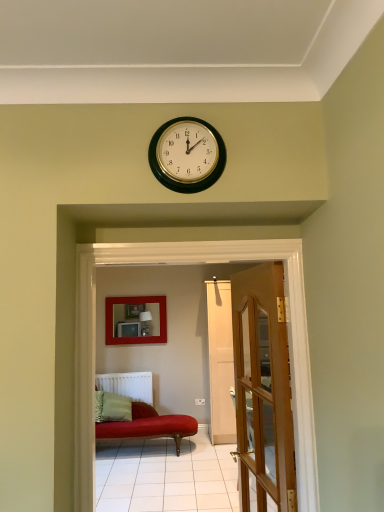
I want to click on matte red picture frame at center, so click(x=136, y=337).

This screenshot has width=384, height=512. Describe the element at coordinates (136, 337) in the screenshot. I see `matte red picture frame at center` at that location.

The width and height of the screenshot is (384, 512). Describe the element at coordinates (263, 388) in the screenshot. I see `wooden glass door at center` at that location.

Find the location of a particular element. This screenshot has height=512, width=384. matte red picture frame at center is located at coordinates (136, 337).

Considering the relative positions of matte red couch at center and green fabric pillow at lower left in the image provided, is matte red couch at center behind green fabric pillow at lower left?

No, it is not.

I want to click on pillow located underneath the matte red couch at center (from a real-world perspective), so click(112, 407).

Is matte red couch at center inside the boundaries of green fabric pillow at lower left, or outside?

The correct answer is: outside.

Is matte red picture frame at center at the right side of white matte radiator at lower left?

Yes, matte red picture frame at center is to the right of white matte radiator at lower left.

Is the surface of matte red picture frame at center in direct contact with white matte radiator at lower left?

No, matte red picture frame at center is not touching white matte radiator at lower left.

Considering the sizes of matte red picture frame at center and white matte radiator at lower left in the image, is matte red picture frame at center wider or thinner than white matte radiator at lower left?

Considering their sizes, matte red picture frame at center looks slimmer than white matte radiator at lower left.

From the image's perspective, between matte red picture frame at center and wooden glass door at center, who is located below?

matte red picture frame at center, from the image's perspective.

Considering the relative sizes of matte red picture frame at center and wooden glass door at center in the image provided, is matte red picture frame at center smaller than wooden glass door at center?

Yes, matte red picture frame at center is smaller than wooden glass door at center.

Is matte red picture frame at center outside of wooden glass door at center?

Yes.

From the image's perspective, who appears lower, green fabric pillow at lower left or matte red picture frame at center?

green fabric pillow at lower left is shown below in the image.

In the image, is green fabric pillow at lower left positioned in front of or behind matte red picture frame at center?

Visually, green fabric pillow at lower left is located in front of matte red picture frame at center.

Can you confirm if green fabric pillow at lower left is wider than matte red picture frame at center?

Yes.

Is green fabric pillow at lower left far away from matte red picture frame at center?

No, green fabric pillow at lower left is in close proximity to matte red picture frame at center.

Locate an element on the screen. Image resolution: width=384 pixels, height=512 pixels. radiator that appears below the matte red picture frame at center (from a real-world perspective) is located at coordinates (127, 385).

Is point (122, 377) closer or farther from the camera than point (162, 326)?

Point (122, 377) is closer to the camera than point (162, 326).

Considering the relative positions of white matte radiator at lower left and matte red picture frame at center in the image provided, is white matte radiator at lower left behind matte red picture frame at center?

No.

Could you tell me if white matte radiator at lower left is facing matte red picture frame at center?

No, white matte radiator at lower left is not aimed at matte red picture frame at center.

Consider the image. Considering the relative positions of matte red couch at center and wooden glass door at center in the image provided, is matte red couch at center in front of wooden glass door at center?

Yes.

Considering the sizes of matte red couch at center and wooden glass door at center in the image, is matte red couch at center bigger or smaller than wooden glass door at center?

In the image, matte red couch at center appears to be smaller than wooden glass door at center.

Is matte red couch at center positioned with its back to wooden glass door at center?

matte red couch at center does not have its back to wooden glass door at center.

Visually, is matte red couch at center positioned to the left or to the right of wooden glass door at center?

matte red couch at center is to the left of wooden glass door at center.

Can you confirm if matte red couch at center is taller than white matte radiator at lower left?

Yes, matte red couch at center is taller than white matte radiator at lower left.

Is matte red couch at center bigger or smaller than white matte radiator at lower left?

matte red couch at center is bigger than white matte radiator at lower left.

How many degrees apart are the facing directions of matte red couch at center and white matte radiator at lower left?

The facing directions of matte red couch at center and white matte radiator at lower left are 179 degrees apart.

Looking at this image, considering the relative positions of matte red couch at center and white matte radiator at lower left in the image provided, is matte red couch at center behind white matte radiator at lower left?

That is False.

At what (x,y) coordinates should I click in order to perform the action: click on pillow below the matte red couch at center (from the image's perspective). Please return your answer as a coordinate pair (x, y). The width and height of the screenshot is (384, 512). Looking at the image, I should click on (112, 407).

The image size is (384, 512). Identify the location of picture frame above the white matte radiator at lower left (from a real-world perspective). (136, 337).

Which object lies further to the anchor point green fabric pillow at lower left, white matte radiator at lower left or matte red couch at center?

matte red couch at center is positioned further to the anchor green fabric pillow at lower left.

From the image, which object appears to be nearer to wooden glass door at center, white matte radiator at lower left or matte red picture frame at center?

white matte radiator at lower left is positioned closer to the anchor wooden glass door at center.

Looking at the image, which one is located closer to matte red couch at center, green fabric pillow at lower left or matte red picture frame at center?

Based on the image, green fabric pillow at lower left appears to be nearer to matte red couch at center.

Which object lies nearer to the anchor point matte red couch at center, white matte radiator at lower left or wooden glass door at center?

wooden glass door at center is positioned closer to the anchor matte red couch at center.

Based on their spatial positions, is white matte radiator at lower left or matte red couch at center further from matte red picture frame at center?

matte red couch at center.

Estimate the real-world distances between objects in this image. Which object is further from matte red picture frame at center, white matte radiator at lower left or wooden glass door at center?

The object further to matte red picture frame at center is wooden glass door at center.

Which object lies nearer to the anchor point matte red picture frame at center, matte red couch at center or wooden glass door at center?

Among the two, wooden glass door at center is located nearer to matte red picture frame at center.

Based on the photo, from the image, which object appears to be nearer to matte red couch at center, wooden glass door at center or matte red picture frame at center?

The object closer to matte red couch at center is wooden glass door at center.

Where is `pillow positioned between matte red couch at center and matte red picture frame at center from near to far`? pillow positioned between matte red couch at center and matte red picture frame at center from near to far is located at coordinates (112, 407).

Find the location of a particular element. The width and height of the screenshot is (384, 512). door positioned between matte red couch at center and white matte radiator at lower left from near to far is located at coordinates click(x=263, y=388).

Locate an element on the screen. radiator positioned between wooden glass door at center and matte red picture frame at center from near to far is located at coordinates (127, 385).

Where is `radiator between matte red picture frame at center and green fabric pillow at lower left from top to bottom`? The height and width of the screenshot is (512, 384). radiator between matte red picture frame at center and green fabric pillow at lower left from top to bottom is located at coordinates (127, 385).